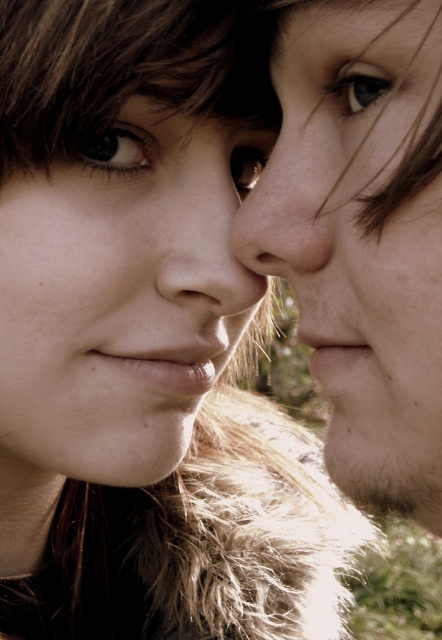
Question: Which object appears farthest from the camera in this image?

Choices:
 (A) matte skin forehead at upper center
 (B) matte skin face at center

Answer: (A)

Question: Which object appears farthest from the camera in this image?

Choices:
 (A) smooth skin face at center
 (B) blue glossy eye at upper center
 (C) matte skin nose at center

Answer: (C)

Question: Is smooth skin nose at center closer to the viewer compared to matte skin forehead at upper center?

Choices:
 (A) yes
 (B) no

Answer: (B)

Question: In this image, where is matte skin nose at center located relative to matte skin forehead at upper center?

Choices:
 (A) right
 (B) left

Answer: (B)

Question: Which object is the closest to the matte skin forehead at upper center?

Choices:
 (A) smooth skin nose at center
 (B) blue glossy eye at upper center
 (C) matte skin nose at center

Answer: (B)

Question: Is smooth skin nose at center above brown matte eye at upper left?

Choices:
 (A) yes
 (B) no

Answer: (B)